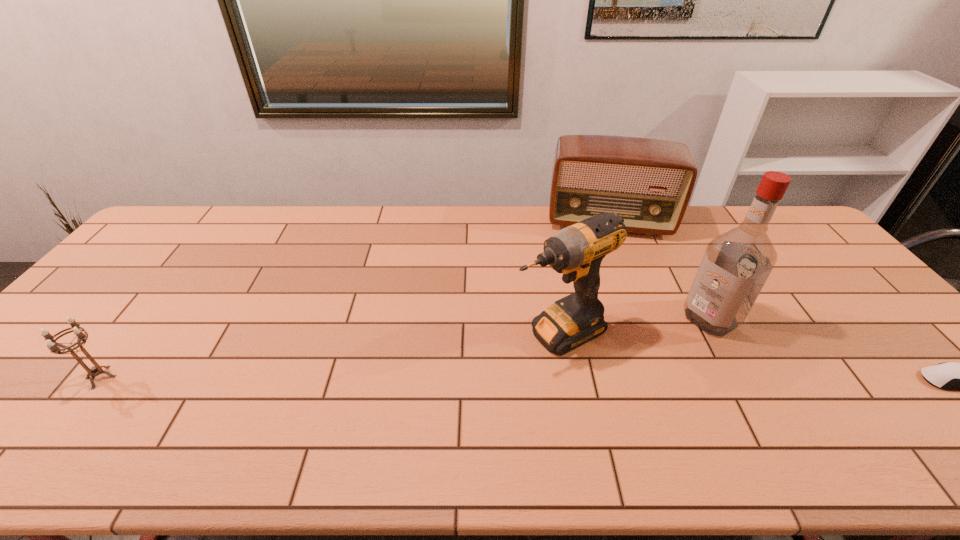
Identify the location of the leftmost object. The height and width of the screenshot is (540, 960). (54, 347).

Where is `the fourth tallest object`? The image size is (960, 540). the fourth tallest object is located at coordinates (54, 347).

Find the location of a particular element. This screenshot has height=540, width=960. the third shortest object is located at coordinates (648, 182).

This screenshot has height=540, width=960. What are the coordinates of `the farthest object` in the screenshot? It's located at (648, 182).

You are a GUI agent. You are given a task and a screenshot of the screen. Output one action in this format:
    pyautogui.click(x=<x>, y=<y>)
    Task: Click on the fourth shortest object
    This screenshot has width=960, height=540.
    Given the screenshot: What is the action you would take?
    pyautogui.click(x=577, y=251)

You are a GUI agent. You are given a task and a screenshot of the screen. Output one action in this format:
    pyautogui.click(x=<x>, y=<y>)
    Task: Click on the tallest object
    This screenshot has height=540, width=960.
    Given the screenshot: What is the action you would take?
    pyautogui.click(x=736, y=264)

This screenshot has height=540, width=960. Find the location of `vacant area situated 0.370m on the back of the candle holder`. vacant area situated 0.370m on the back of the candle holder is located at coordinates (187, 267).

Identify the location of free location located on the front-facing side of the third shortest object. This screenshot has width=960, height=540. (606, 252).

Locate an element on the screen. free space located on the front-facing side of the third shortest object is located at coordinates (610, 320).

Identify the location of vacant space situated on the front-facing side of the third shortest object. (609, 298).